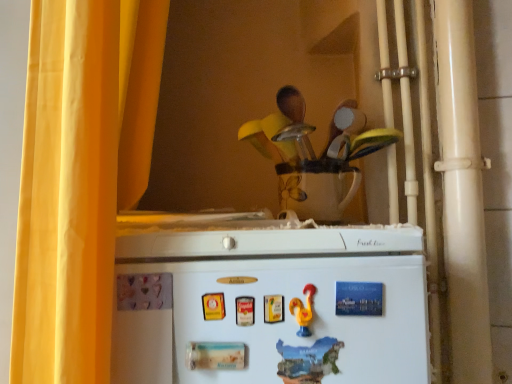
You are a GUI agent. You are given a task and a screenshot of the screen. Output one action in this format:
    pyautogui.click(x=<x>, y=<y>)
    Task: Click on the white matte refrigerator at lower center
    This screenshot has width=512, height=384.
    Given the screenshot: What is the action you would take?
    pyautogui.click(x=270, y=305)

Locate an element on the screen. Image resolution: width=512 pixels, height=384 pixels. blue paper magnet at upper center, which is the first magnet from back to front is located at coordinates (359, 298).

The width and height of the screenshot is (512, 384). I want to click on yellow fabric curtain at left, so click(x=80, y=177).

Measure the distance between yellow fabric curtain at left and camera.

yellow fabric curtain at left is 22.31 inches from camera.

What do you see at coordinates (215, 355) in the screenshot? I see `white matte magnet at lower center, the 2th magnet viewed from the top` at bounding box center [215, 355].

What are the coordinates of `white matte refrigerator at lower center` in the screenshot? It's located at (270, 305).

From the image's perspective, is white matte refrigerator at lower center under yellow fabric curtain at left?

Yes, from the image's perspective, white matte refrigerator at lower center is beneath yellow fabric curtain at left.

Considering the relative sizes of white matte refrigerator at lower center and yellow fabric curtain at left in the image provided, is white matte refrigerator at lower center taller than yellow fabric curtain at left?

No.

Considering the relative positions of white matte refrigerator at lower center and yellow fabric curtain at left in the image provided, is white matte refrigerator at lower center to the right of yellow fabric curtain at left from the viewer's perspective?

Yes.

Is white matte refrigerator at lower center next to wooden spoon set at upper center and touching it?

No, white matte refrigerator at lower center is not in contact with wooden spoon set at upper center.

In terms of height, does white matte refrigerator at lower center look taller or shorter compared to wooden spoon set at upper center?

white matte refrigerator at lower center is shorter than wooden spoon set at upper center.

Could you tell me if white matte refrigerator at lower center is turned towards wooden spoon set at upper center?

No, white matte refrigerator at lower center is not turned towards wooden spoon set at upper center.

Locate an element on the screen. The height and width of the screenshot is (384, 512). refrigerator that is below the wooden spoon set at upper center (from the image's perspective) is located at coordinates pyautogui.click(x=270, y=305).

From the picture: Is yellow fabric curtain at left taller or shorter than wooden spoon set at upper center?

Clearly, yellow fabric curtain at left is taller compared to wooden spoon set at upper center.

From the image's perspective, which is above, yellow fabric curtain at left or wooden spoon set at upper center?

wooden spoon set at upper center, from the image's perspective.

Does yellow fabric curtain at left turn towards wooden spoon set at upper center?

Yes, yellow fabric curtain at left is aimed at wooden spoon set at upper center.

Is point (296, 209) farther from viewer compared to point (213, 357)?

Yes, it is.

Does wooden spoon set at upper center turn towards white matte magnet at lower center, placed as the first magnet when sorted from front to back?

No.

From the image's perspective, which is above, wooden spoon set at upper center or white matte magnet at lower center, the 2th magnet viewed from the top?

wooden spoon set at upper center is shown above in the image.

In the scene shown: Between wooden spoon set at upper center and white matte magnet at lower center, the 2th magnet viewed from the top, which one has larger width?

wooden spoon set at upper center is wider.

From the image's perspective, relative to blue paper magnet at upper center, placed as the 1th magnet when sorted from top to bottom, is white matte magnet at lower center, placed as the first magnet when sorted from front to back, above or below?

white matte magnet at lower center, placed as the first magnet when sorted from front to back, is below blue paper magnet at upper center, placed as the 1th magnet when sorted from top to bottom.

What's the angular difference between white matte magnet at lower center, which appears as the second magnet when viewed from the right, and blue paper magnet at upper center, acting as the 2th magnet starting from the left,'s facing directions?

There is a 3.28-degree angle between the facing directions of white matte magnet at lower center, which appears as the second magnet when viewed from the right, and blue paper magnet at upper center, acting as the 2th magnet starting from the left.

Based on the photo, looking at the image, does white matte magnet at lower center, placed as the first magnet when sorted from front to back, seem bigger or smaller compared to blue paper magnet at upper center, the second magnet from the bottom?

white matte magnet at lower center, placed as the first magnet when sorted from front to back, is smaller than blue paper magnet at upper center, the second magnet from the bottom.

Is white matte magnet at lower center, which appears as the 1th magnet when viewed from the left, facing towards blue paper magnet at upper center, placed as the 1th magnet when sorted from top to bottom?

No, white matte magnet at lower center, which appears as the 1th magnet when viewed from the left, does not turn towards blue paper magnet at upper center, placed as the 1th magnet when sorted from top to bottom.

Considering the relative sizes of yellow fabric curtain at left and white matte refrigerator at lower center in the image provided, is yellow fabric curtain at left shorter than white matte refrigerator at lower center?

No.

Based on the photo, from the image's perspective, between yellow fabric curtain at left and white matte refrigerator at lower center, who is located below?

white matte refrigerator at lower center.

Which is behind, point (73, 152) or point (393, 370)?

The point (393, 370) is farther.

In the scene shown: Is the depth of yellow fabric curtain at left less than that of white matte refrigerator at lower center?

Yes, yellow fabric curtain at left is in front of white matte refrigerator at lower center.

Is point (421, 276) closer or farther from the camera than point (360, 300)?

Point (421, 276) appears to be farther away from the viewer than point (360, 300).

Considering the positions of objects white matte refrigerator at lower center and blue paper magnet at upper center, the second magnet from the bottom, in the image provided, who is more to the right, white matte refrigerator at lower center or blue paper magnet at upper center, the second magnet from the bottom,?

From the viewer's perspective, blue paper magnet at upper center, the second magnet from the bottom, appears more on the right side.

From the image's perspective, is white matte refrigerator at lower center positioned above or below blue paper magnet at upper center, acting as the 2th magnet starting from the left?

Clearly, from the image's perspective, white matte refrigerator at lower center is below blue paper magnet at upper center, acting as the 2th magnet starting from the left.

You are a GUI agent. You are given a task and a screenshot of the screen. Output one action in this format:
    pyautogui.click(x=<x>, y=<y>)
    Task: Click on the refrigerator below the blue paper magnet at upper center, the first magnet from the right (from the image's perspective)
    The width and height of the screenshot is (512, 384).
    Given the screenshot: What is the action you would take?
    pyautogui.click(x=270, y=305)

Where is `refrigerator that is on the right side of yellow fabric curtain at left`? This screenshot has height=384, width=512. refrigerator that is on the right side of yellow fabric curtain at left is located at coordinates (270, 305).

Find the location of a particular element. This screenshot has width=512, height=384. refrigerator in front of the wooden spoon set at upper center is located at coordinates pyautogui.click(x=270, y=305).

Considering their positions, is white matte refrigerator at lower center positioned closer to wooden spoon set at upper center than blue paper magnet at upper center, which is the first magnet from back to front?

white matte refrigerator at lower center is closer to wooden spoon set at upper center.

Based on their spatial positions, is blue paper magnet at upper center, placed as the 1th magnet when sorted from top to bottom, or white matte magnet at lower center, the 2th magnet viewed from the top, further from yellow fabric curtain at left?

The object further to yellow fabric curtain at left is blue paper magnet at upper center, placed as the 1th magnet when sorted from top to bottom.

Estimate the real-world distances between objects in this image. Which object is closer to blue paper magnet at upper center, marked as the second magnet in a front-to-back arrangement, white matte magnet at lower center, which is counted as the 1th magnet, starting from the bottom, or wooden spoon set at upper center?

Among the two, white matte magnet at lower center, which is counted as the 1th magnet, starting from the bottom, is located nearer to blue paper magnet at upper center, marked as the second magnet in a front-to-back arrangement.

Which object lies nearer to the anchor point yellow fabric curtain at left, white matte magnet at lower center, which appears as the 1th magnet when viewed from the left, or blue paper magnet at upper center, marked as the second magnet in a front-to-back arrangement?

The object closer to yellow fabric curtain at left is white matte magnet at lower center, which appears as the 1th magnet when viewed from the left.

Looking at this image, when comparing their distances from white matte magnet at lower center, which appears as the 1th magnet when viewed from the left, does wooden spoon set at upper center or white matte refrigerator at lower center seem closer?

white matte refrigerator at lower center.

Based on their spatial positions, is yellow fabric curtain at left or blue paper magnet at upper center, acting as the 2th magnet starting from the left, further from wooden spoon set at upper center?

yellow fabric curtain at left lies further to wooden spoon set at upper center than the other object.

Which object lies nearer to the anchor point white matte refrigerator at lower center, yellow fabric curtain at left or white matte magnet at lower center, which is the second magnet in back-to-front order?

white matte magnet at lower center, which is the second magnet in back-to-front order, is closer to white matte refrigerator at lower center.

From the image, which object appears to be nearer to yellow fabric curtain at left, white matte refrigerator at lower center or white matte magnet at lower center, which is the second magnet in back-to-front order?

white matte refrigerator at lower center is closer to yellow fabric curtain at left.

The width and height of the screenshot is (512, 384). Find the location of `refrigerator between yellow fabric curtain at left and blue paper magnet at upper center, the first magnet from the right, from left to right`. refrigerator between yellow fabric curtain at left and blue paper magnet at upper center, the first magnet from the right, from left to right is located at coordinates tap(270, 305).

The image size is (512, 384). I want to click on toy located between yellow fabric curtain at left and blue paper magnet at upper center, placed as the 1th magnet when sorted from top to bottom, in the left-right direction, so click(314, 155).

Locate an element on the screen. The image size is (512, 384). magnet situated between yellow fabric curtain at left and wooden spoon set at upper center from left to right is located at coordinates (215, 355).

At what (x,y) coordinates should I click in order to perform the action: click on magnet between wooden spoon set at upper center and white matte refrigerator at lower center in the vertical direction. Please return your answer as a coordinate pair (x, y). Looking at the image, I should click on (359, 298).